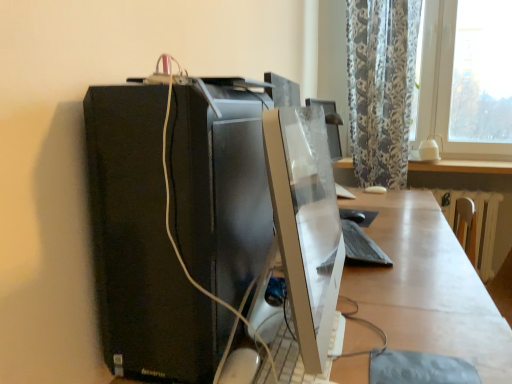
Question: Considering the relative sizes of white glossy table at lower right and satin white monitor at center in the image provided, is white glossy table at lower right thinner than satin white monitor at center?

Choices:
 (A) yes
 (B) no

Answer: (B)

Question: Could you tell me if white glossy table at lower right is turned towards satin white monitor at center?

Choices:
 (A) no
 (B) yes

Answer: (A)

Question: Can you confirm if white glossy table at lower right is smaller than satin white monitor at center?

Choices:
 (A) yes
 (B) no

Answer: (B)

Question: From a real-world perspective, is white glossy table at lower right positioned over satin white monitor at center based on gravity?

Choices:
 (A) yes
 (B) no

Answer: (B)

Question: Can you confirm if white glossy table at lower right is taller than satin white monitor at center?

Choices:
 (A) yes
 (B) no

Answer: (A)

Question: Considering the relative positions of white glossy desk at center and satin white monitor at center in the image provided, is white glossy desk at center to the left or to the right of satin white monitor at center?

Choices:
 (A) right
 (B) left

Answer: (A)

Question: In terms of height, does white glossy desk at center look taller or shorter compared to satin white monitor at center?

Choices:
 (A) short
 (B) tall

Answer: (B)

Question: Considering the positions of white glossy desk at center and satin white monitor at center in the image, is white glossy desk at center wider or thinner than satin white monitor at center?

Choices:
 (A) thin
 (B) wide

Answer: (B)

Question: From a real-world perspective, is white glossy desk at center positioned above or below satin white monitor at center?

Choices:
 (A) above
 (B) below

Answer: (B)

Question: Based on their sizes in the image, would you say white glossy table at lower right is bigger or smaller than black matte computer tower at left?

Choices:
 (A) big
 (B) small

Answer: (A)

Question: Is point (389, 195) closer or farther from the camera than point (120, 203)?

Choices:
 (A) closer
 (B) farther

Answer: (B)

Question: In terms of width, does white glossy table at lower right look wider or thinner when compared to black matte computer tower at left?

Choices:
 (A) thin
 (B) wide

Answer: (B)

Question: Considering the relative positions of white glossy table at lower right and black matte computer tower at left in the image provided, is white glossy table at lower right to the left or to the right of black matte computer tower at left?

Choices:
 (A) left
 (B) right

Answer: (B)

Question: Is white glossy table at lower right bigger or smaller than satin white monitor at center?

Choices:
 (A) big
 (B) small

Answer: (A)

Question: In terms of height, does white glossy table at lower right look taller or shorter compared to satin white monitor at center?

Choices:
 (A) tall
 (B) short

Answer: (A)